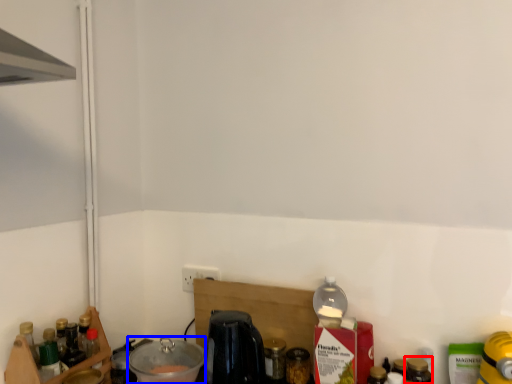
Question: Which object is closer to the camera taking this photo, bottle (highlighted by a red box) or appliance (highlighted by a blue box)?

Choices:
 (A) bottle
 (B) appliance

Answer: (A)